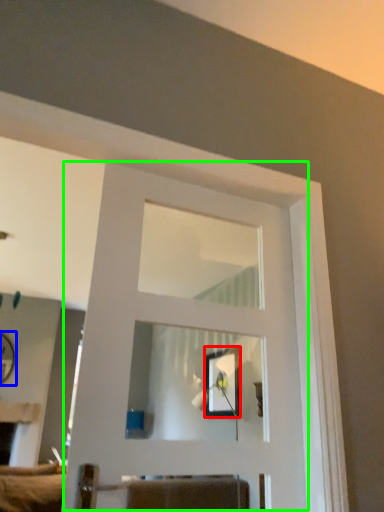
Question: Considering the real-world distances, which object is closest to picture frame (highlighted by a red box)? mirror (highlighted by a blue box) or door (highlighted by a green box).

Choices:
 (A) mirror
 (B) door

Answer: (B)